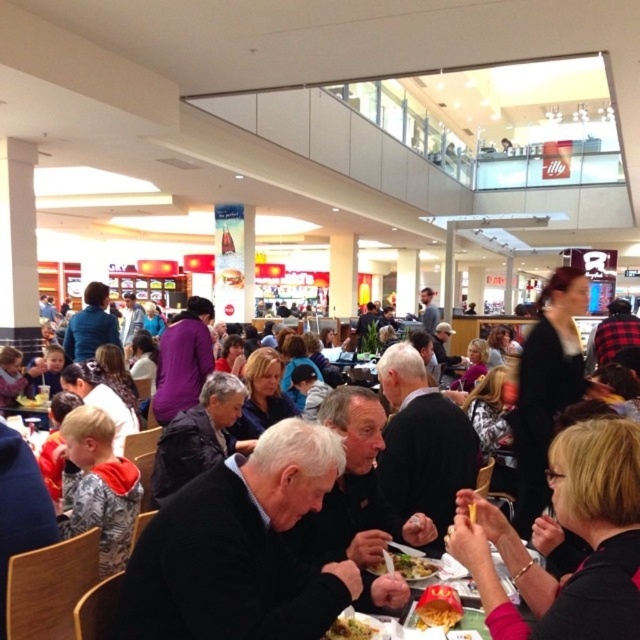
You are a customer in the food court and want to find the tallest sweater between the black sweater at center and the black textured sweater at lower right. Which one should you look for?

The black sweater at center is taller than the black textured sweater at lower right, so you should look for the black sweater at center.

You are a photographer standing in the food court and want to capture both the black sweater at center and the black textured sweater at lower right in the same frame. Can you fit both into your camera viewfinder without moving your position?

The black sweater at center is only 4.21 centimeters away from the black textured sweater at lower right, so yes, both can be captured in the same frame without moving.